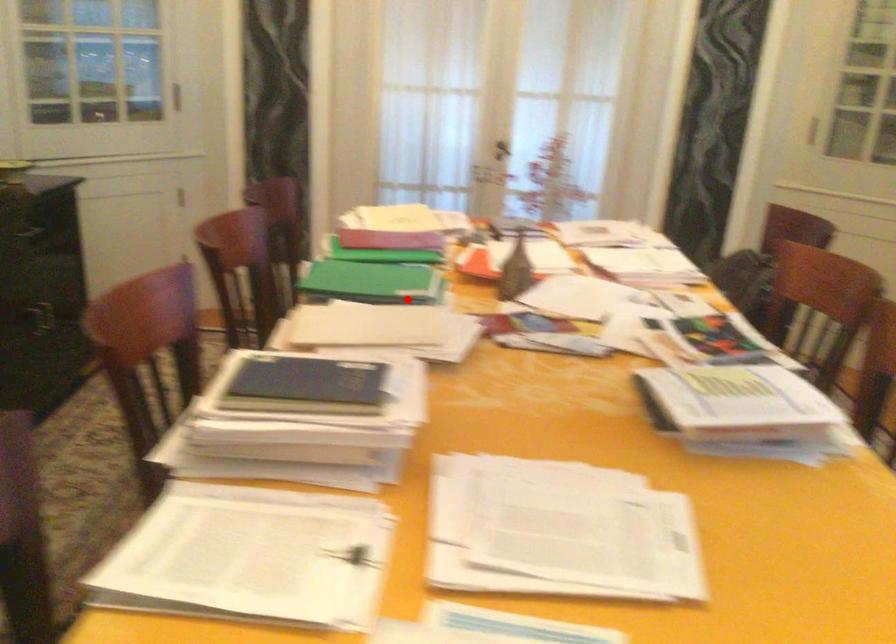
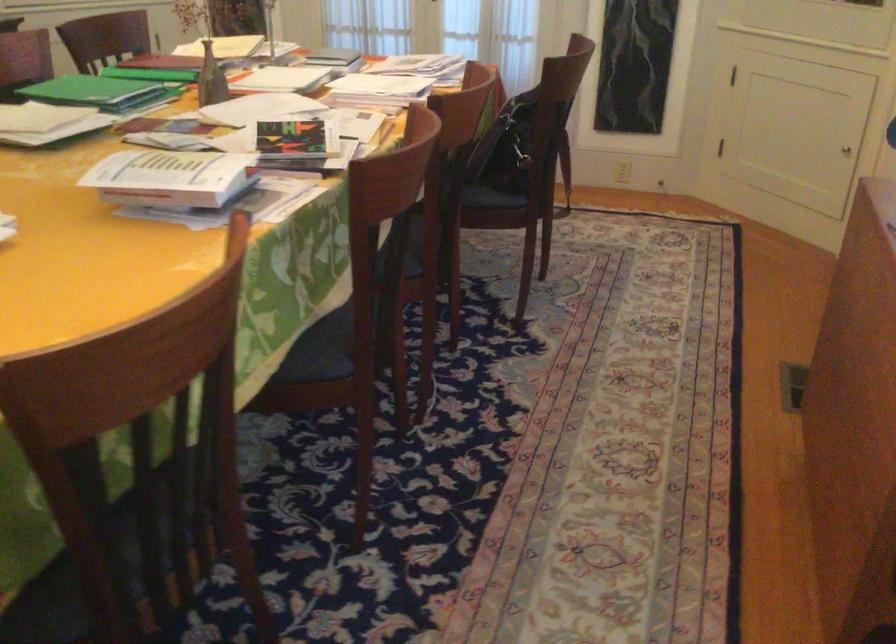
Question: I am providing you with two images of the same scene from different viewpoints. Image1 has a red point marked. In image2, the corresponding 3D location appears at what relative position? Reply with the corresponding letter.

Choices:
 (A) Closer
 (B) Farther

Answer: (B)